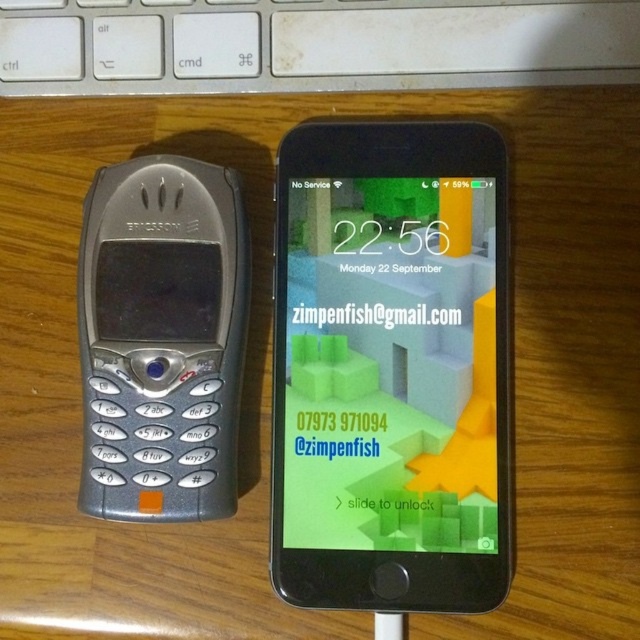
Question: Which object appears closest to the camera in this image?

Choices:
 (A) white plastic keyboard at upper center
 (B) matte black smartphone at center
 (C) silver metallic phone at left

Answer: (C)

Question: Can you confirm if matte black smartphone at center is wider than white plastic keyboard at upper center?

Choices:
 (A) no
 (B) yes

Answer: (A)

Question: Does white plastic keyboard at upper center appear on the right side of silver metallic phone at left?

Choices:
 (A) no
 (B) yes

Answer: (B)

Question: Does matte black smartphone at center appear over silver metallic phone at left?

Choices:
 (A) no
 (B) yes

Answer: (A)

Question: Which point is farther from the camera taking this photo?

Choices:
 (A) (636, 29)
 (B) (465, 211)

Answer: (B)

Question: Among these objects, which one is farthest from the camera?

Choices:
 (A) silver metallic phone at left
 (B) white plastic keyboard at upper center
 (C) matte black smartphone at center

Answer: (B)